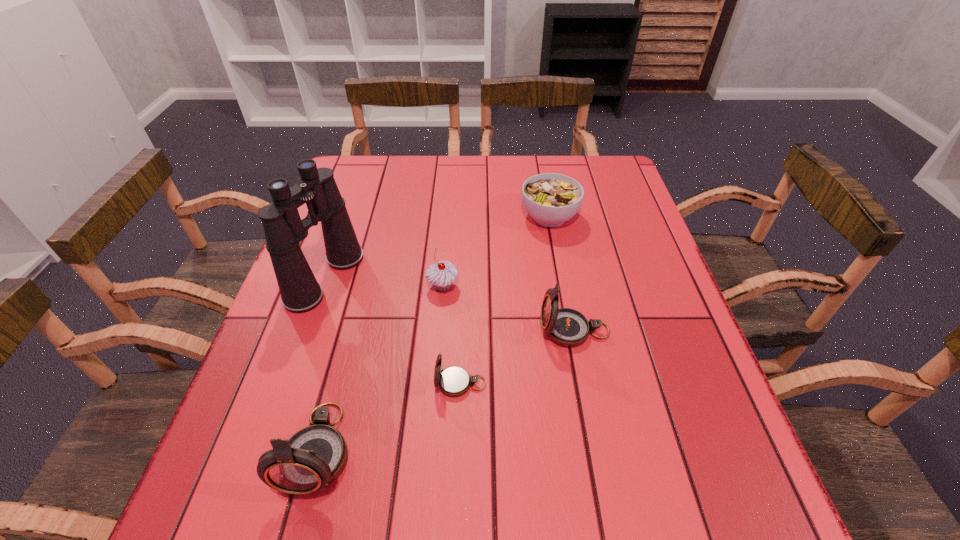
I want to click on vacant region located on the face of the second compass from right to left, so click(337, 383).

Where is `vacant space located on the face of the second compass from right to left`? The image size is (960, 540). vacant space located on the face of the second compass from right to left is located at coordinates (383, 383).

Where is `vacant region located 0.160m on the face of the third tallest object`? vacant region located 0.160m on the face of the third tallest object is located at coordinates (466, 331).

This screenshot has width=960, height=540. I want to click on free location located on the face of the third tallest object, so click(456, 331).

What are the coordinates of `free space located 0.230m on the face of the third tallest object` in the screenshot? It's located at coord(433,331).

You are a GUI agent. You are given a task and a screenshot of the screen. Output one action in this format:
    pyautogui.click(x=<x>, y=<y>)
    Task: Click on the blank space located on the front of the soup bowl
    
    Given the screenshot: What is the action you would take?
    pyautogui.click(x=556, y=253)

Find the location of a particular element. The image size is (960, 540). vacant point located on the front of the tallest object is located at coordinates (269, 440).

Locate an element on the screen. vacant space located 0.260m on the back of the fourth tallest object is located at coordinates (449, 211).

Where is `object that is at the near edge`? object that is at the near edge is located at coordinates (313, 457).

The image size is (960, 540). What are the coordinates of `compass located in the left edge section of the desktop` in the screenshot? It's located at point(313,457).